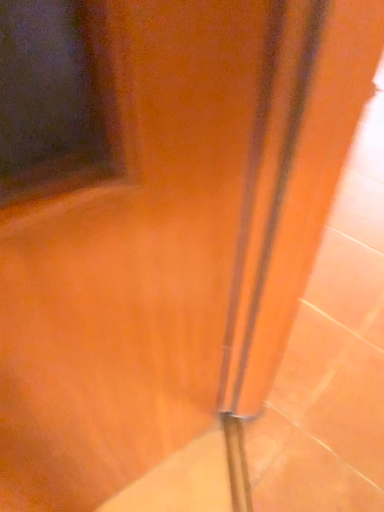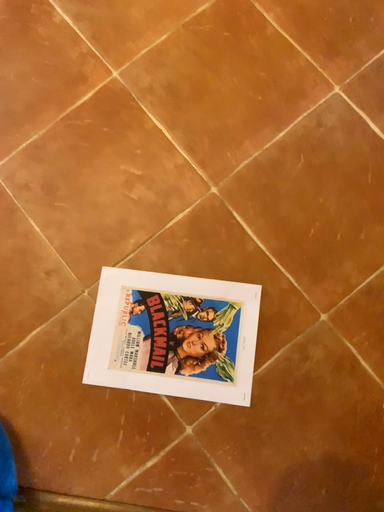
Question: How did the camera likely rotate when shooting the video?

Choices:
 (A) rotated right
 (B) rotated left

Answer: (A)